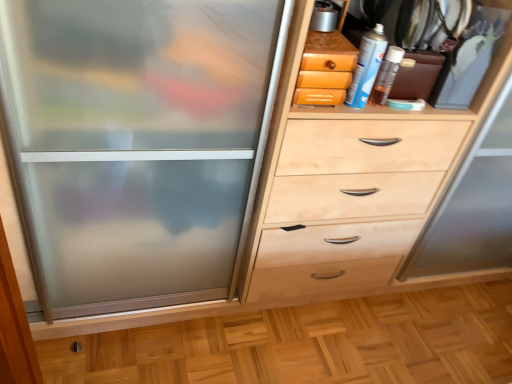
The width and height of the screenshot is (512, 384). I want to click on free space above natural wood floor at lower center (from a real-world perspective), so click(x=357, y=348).